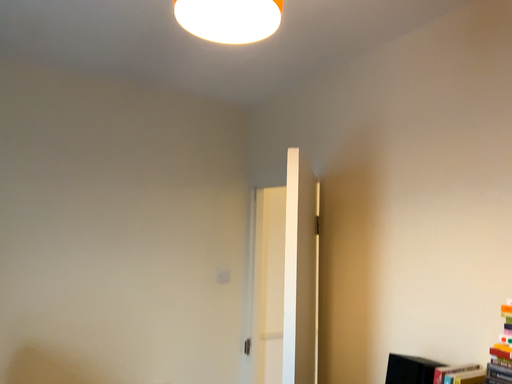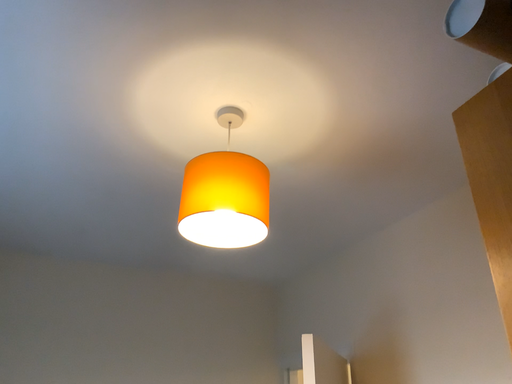
Question: How did the camera likely rotate when shooting the video?

Choices:
 (A) rotated upward
 (B) rotated downward

Answer: (A)